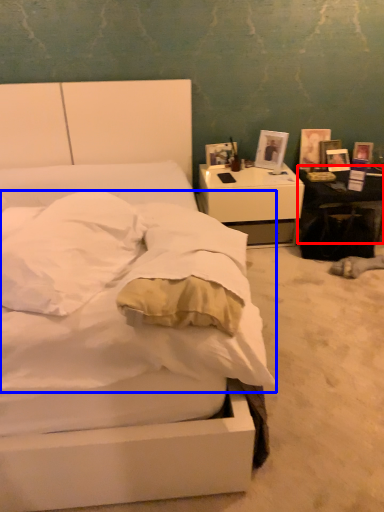
Question: Which point is closer to the camera, table (highlighted by a red box) or mattress (highlighted by a blue box)?

Choices:
 (A) table
 (B) mattress

Answer: (B)